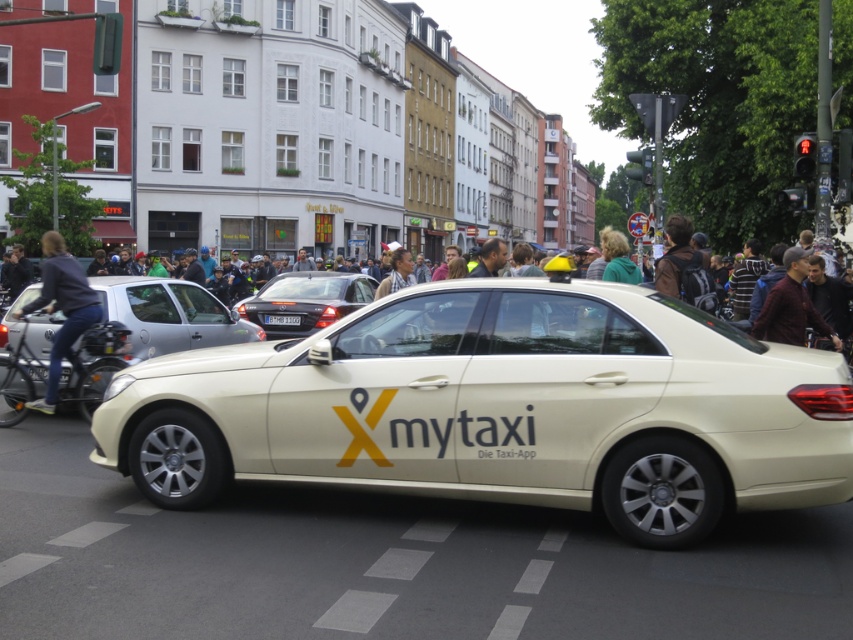
You are a pedestrian looking at the matte white taxi at center and the dark brown leather jacket at right. Which object is positioned lower in the image?

The matte white taxi at center is positioned lower than the dark brown leather jacket at right in the image.

You are a delivery drone operator. Your drone is currently at the point marked by the coordinates point (500,410). You need to deliver a package to the beige taxi displaying the branding Xmytaxi in the scene. Can you safely land your drone on the beige taxi displaying the branding Xmytaxi from your current position?

The point (500,410) corresponds to the matte white taxi at center, which is the beige taxi displaying the branding Xmytaxi. Therefore, the drone is already positioned above the beige taxi displaying the branding Xmytaxi and can safely land there.

You are a pedestrian standing on the sidewalk and want to cross the street. You see a metallic silver sedan at center and a shiny black sedan at center. Which car is closer to you?

The metallic silver sedan at center is closer to you because it is in front of the shiny black sedan at center.